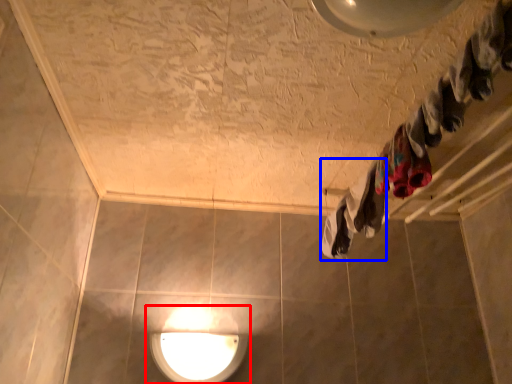
Question: Which object is further to the camera taking this photo, lamp (highlighted by a red box) or clothing (highlighted by a blue box)?

Choices:
 (A) lamp
 (B) clothing

Answer: (A)